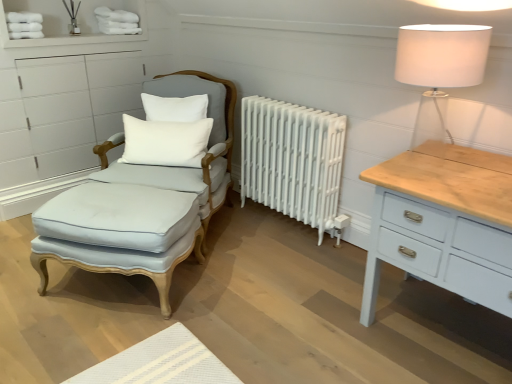
You are a GUI agent. You are given a task and a screenshot of the screen. Output one action in this format:
    pyautogui.click(x=<x>, y=<y>)
    Task: Click on the vacant region under white painted metal radiator at center (from a real-world perspective)
    This screenshot has width=512, height=384.
    Given the screenshot: What is the action you would take?
    pyautogui.click(x=296, y=225)